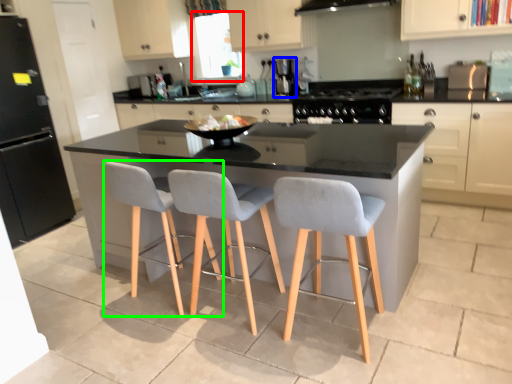
Question: Based on their relative distances, which object is nearer to window screen (highlighted by a red box)? Choose from coffee machine (highlighted by a blue box) and chair (highlighted by a green box).

Choices:
 (A) coffee machine
 (B) chair

Answer: (A)